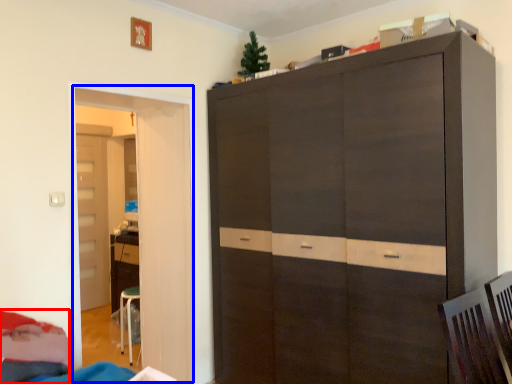
Question: Which object appears farthest to the camera in this image, bed (highlighted by a red box) or door (highlighted by a blue box)?

Choices:
 (A) bed
 (B) door

Answer: (B)